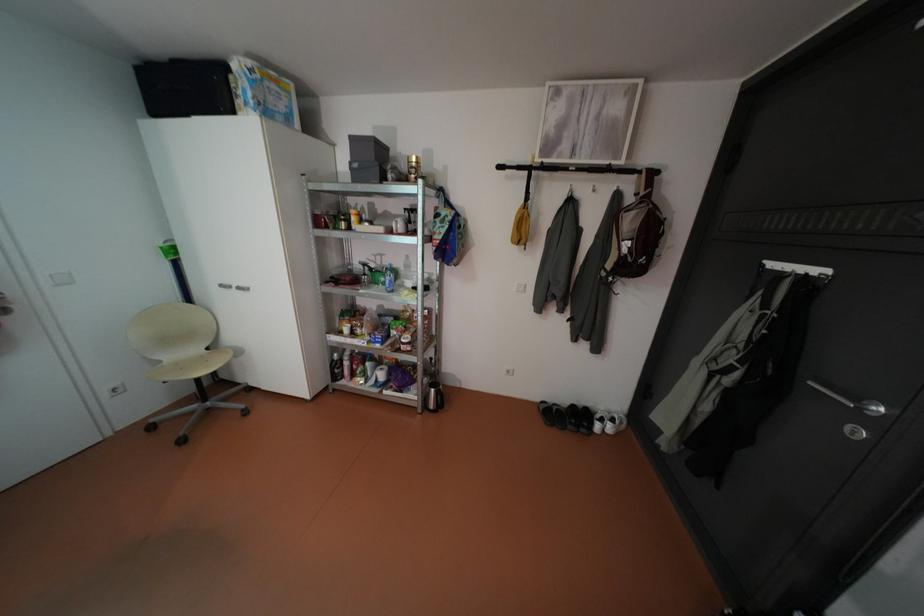
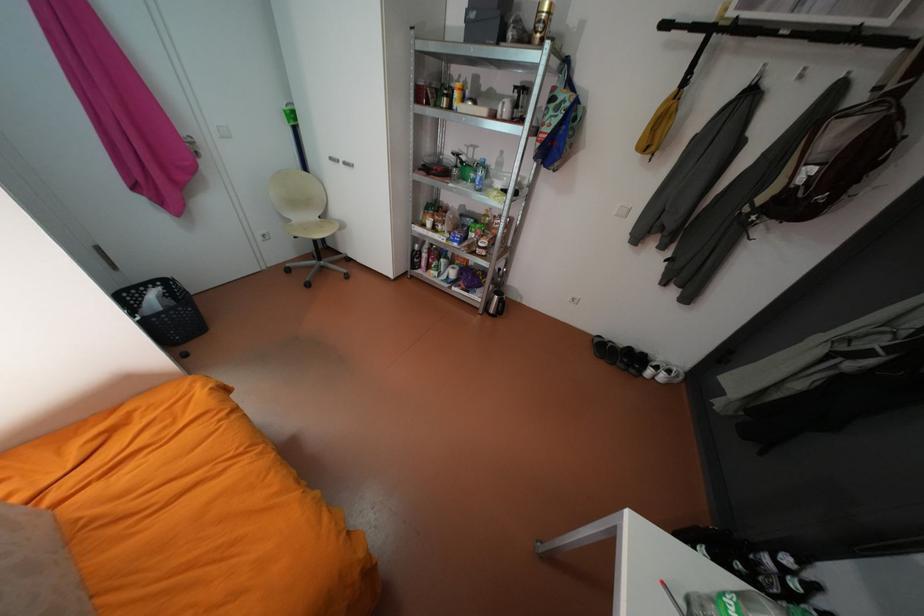
In the second image, find the point that corresponds to pixel 175 379 in the first image.

(306, 233)